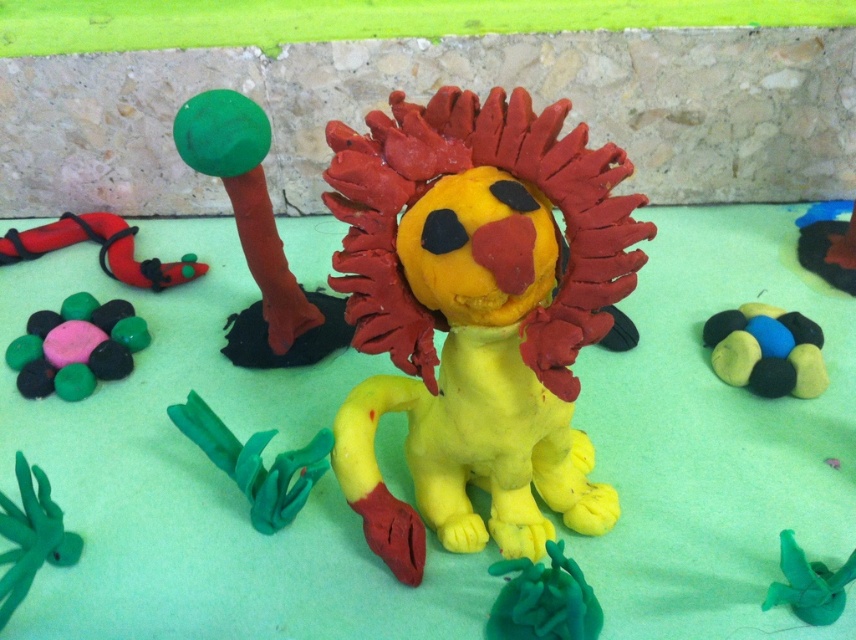
You are a small insect trying to climb from the matte clay rocks at center to the green clay plant at lower left. Considering their heights, which one is easier to climb onto?

The matte clay rocks at center has a lesser height compared to green clay plant at lower left, so it would be easier for the insect to climb onto the matte clay rocks at center first.

From the picture: You are an artist creating a miniature landscape with the matte clay rocks at center and the green clay plant at lower left. If you want to place a small clay frog between them, which object should be closer to the frog to ensure it fits within the scene?

The matte clay rocks at center has a lesser width compared to the green clay plant at lower left, so the frog should be placed closer to the matte clay rocks at center to maintain proportion and balance in the scene.

Based on the photo, you are a small insect trying to climb onto the yellow clay lion at center from the matte clay rocks at center. Based on the scene description, can you reach the lion by climbing up the rocks?

The yellow clay lion at center is located above the matte clay rocks at center, so yes, the insect can climb up the rocks to reach the lion.